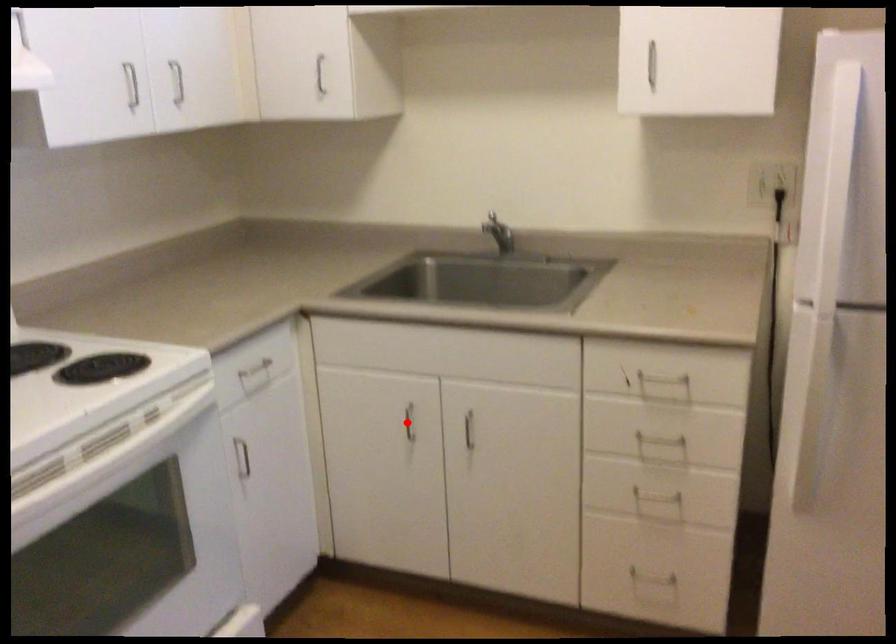
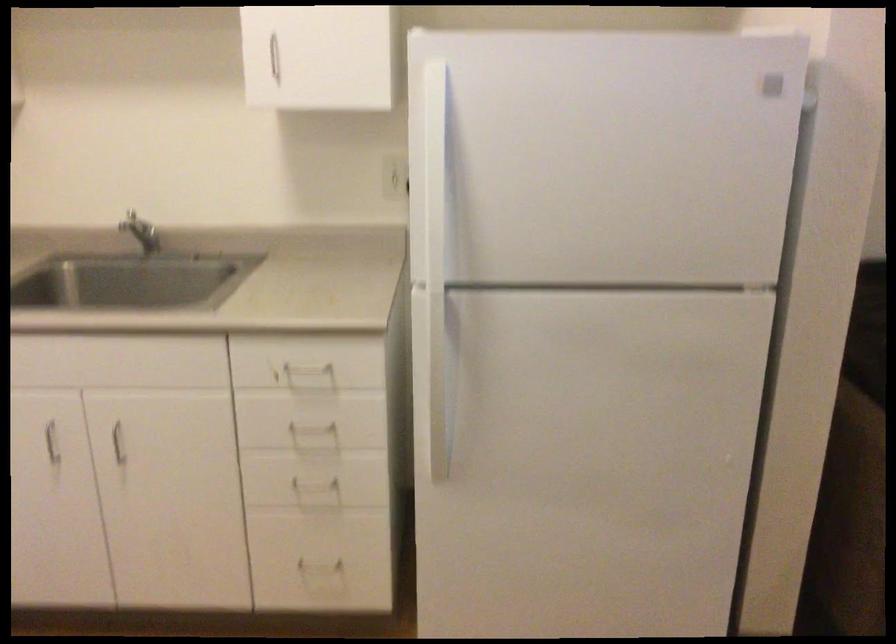
Find the pixel in the second image that matches the highlighted location in the first image.

(52, 442)